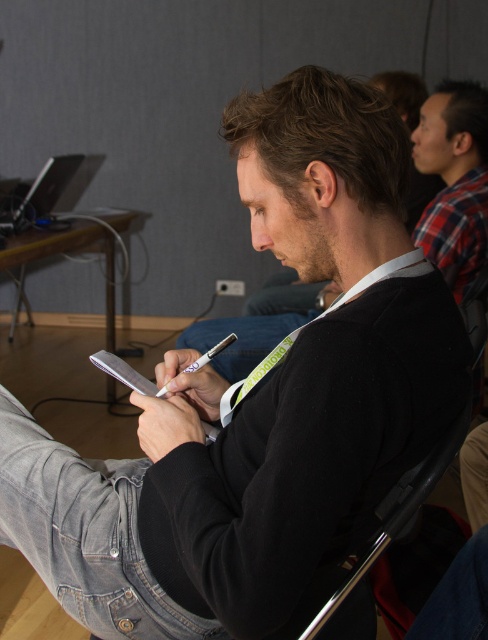
From the picture: You are attending a conference and need to locate the black matte jacket at center and the plaid fabric shirt at upper right. Which one is positioned lower in the image?

The black matte jacket at center is positioned below the plaid fabric shirt at upper right, so the black matte jacket at center is lower in the image.

You are organizing a photo shoot and need to arrange two items in the scene. The black matte jacket at center and the plaid fabric shirt at upper right. Which item should be placed lower to maintain the existing spatial relationship?

The black matte jacket at center should be placed lower since it has a lesser height compared to the plaid fabric shirt at upper right, maintaining their original vertical positioning.

You are organizing a photo shoot and need to arrange the black matte jacket at center and the plaid fabric shirt at upper right in a way that maintains their original positions relative to each other. Which item should be placed to the right side of the other?

The black matte jacket at center should be placed to the right of the plaid fabric shirt at upper right because the original description states that the black matte jacket at center is to the right of plaid fabric shirt at upper right.